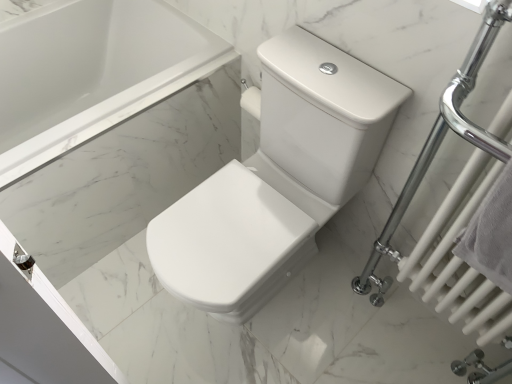
What do you see at coordinates (277, 179) in the screenshot? The height and width of the screenshot is (384, 512). I see `white glossy toilet at center` at bounding box center [277, 179].

Locate an element on the screen. The height and width of the screenshot is (384, 512). white glossy towel rack at right is located at coordinates (440, 143).

Locate an element on the screen. The width and height of the screenshot is (512, 384). white cotton towel at right is located at coordinates (490, 234).

In the scene shown: Is white marble bathtub at upper left to the right of white cotton towel at right from the viewer's perspective?

In fact, white marble bathtub at upper left is to the left of white cotton towel at right.

Could you tell me if white marble bathtub at upper left is turned towards white cotton towel at right?

Yes, white marble bathtub at upper left faces towards white cotton towel at right.

From the image's perspective, which is above, white marble bathtub at upper left or white cotton towel at right?

white marble bathtub at upper left.

Considering the sizes of white marble bathtub at upper left and white cotton towel at right in the image, is white marble bathtub at upper left wider or thinner than white cotton towel at right?

In the image, white marble bathtub at upper left appears to be wider than white cotton towel at right.

Considering the relative sizes of white cotton towel at right and white glossy toilet at center in the image provided, is white cotton towel at right bigger than white glossy toilet at center?

No, white cotton towel at right is not bigger than white glossy toilet at center.

From a real-world perspective, between white cotton towel at right and white glossy toilet at center, who is vertically lower?

white glossy toilet at center.

Is point (495, 240) less distant than point (277, 111)?

Yes, point (495, 240) is closer to viewer.

Locate an element on the screen. bath towel above the white glossy toilet at center (from a real-world perspective) is located at coordinates (490, 234).

Is white glossy toilet at center far away from white marble bathtub at upper left?

They are positioned close to each other.

Where is `bathtub below the white glossy toilet at center (from a real-world perspective)`? The width and height of the screenshot is (512, 384). bathtub below the white glossy toilet at center (from a real-world perspective) is located at coordinates (91, 73).

Considering the positions of objects white glossy toilet at center and white marble bathtub at upper left in the image provided, who is behind, white glossy toilet at center or white marble bathtub at upper left?

white marble bathtub at upper left is behind.

Does point (353, 172) appear closer or farther from the camera than point (26, 80)?

Point (353, 172) is closer to the camera than point (26, 80).

In the image, is white cotton towel at right positioned in front of or behind white glossy towel rack at right?

white cotton towel at right is positioned farther from the viewer than white glossy towel rack at right.

Is there a large distance between white cotton towel at right and white glossy towel rack at right?

That's not correct — white cotton towel at right is a little close to white glossy towel rack at right.

Is point (474, 231) positioned before point (465, 77)?

That is True.

Is white cotton towel at right taller or shorter than white glossy towel rack at right?

white cotton towel at right is shorter than white glossy towel rack at right.

From the image's perspective, which is below, white cotton towel at right or white marble bathtub at upper left?

white cotton towel at right.

How many degrees apart are the facing directions of white cotton towel at right and white marble bathtub at upper left?

They differ by 90.1 degrees in their facing directions.

Based on the photo, does white cotton towel at right lie behind white marble bathtub at upper left?

No, it is not.

In the scene shown: Which of these two, white cotton towel at right or white marble bathtub at upper left, stands shorter?

Standing shorter between the two is white cotton towel at right.

Is white glossy towel rack at right positioned with its back to white glossy toilet at center?

No.

From the image's perspective, relative to white glossy toilet at center, is white glossy towel rack at right above or below?

white glossy towel rack at right is situated lower than white glossy toilet at center in the image.

Which is correct: white glossy towel rack at right is inside white glossy toilet at center, or outside of it?

white glossy towel rack at right is outside white glossy toilet at center.

In order to click on shower below the white marble bathtub at upper left (from the image's perspective) in this screenshot , I will do [x=440, y=143].

Is white glossy towel rack at right positioned with its back to white marble bathtub at upper left?

white glossy towel rack at right does not have its back to white marble bathtub at upper left.

Can you confirm if white glossy towel rack at right is bigger than white marble bathtub at upper left?

No, white glossy towel rack at right is not bigger than white marble bathtub at upper left.

Considering the positions of objects white glossy towel rack at right and white marble bathtub at upper left in the image provided, who is more to the left, white glossy towel rack at right or white marble bathtub at upper left?

white marble bathtub at upper left.

This screenshot has height=384, width=512. What are the coordinates of `bath towel below the white marble bathtub at upper left (from the image's perspective)` in the screenshot? It's located at 490,234.

Identify the location of toilet on the left of white cotton towel at right. Image resolution: width=512 pixels, height=384 pixels. tap(277, 179).

Based on their spatial positions, is white glossy towel rack at right or white cotton towel at right closer to white glossy toilet at center?

white glossy towel rack at right lies closer to white glossy toilet at center than the other object.

When comparing their distances from white glossy toilet at center, does white cotton towel at right or white marble bathtub at upper left seem further?

The object further to white glossy toilet at center is white marble bathtub at upper left.

Estimate the real-world distances between objects in this image. Which object is closer to white marble bathtub at upper left, white glossy towel rack at right or white glossy toilet at center?

white glossy toilet at center is positioned closer to the anchor white marble bathtub at upper left.

Estimate the real-world distances between objects in this image. Which object is further from white glossy towel rack at right, white glossy toilet at center or white cotton towel at right?

The object further to white glossy towel rack at right is white glossy toilet at center.

Estimate the real-world distances between objects in this image. Which object is closer to white glossy toilet at center, white marble bathtub at upper left or white glossy towel rack at right?

white glossy towel rack at right is closer to white glossy toilet at center.

When comparing their distances from white cotton towel at right, does white glossy toilet at center or white marble bathtub at upper left seem further?

white marble bathtub at upper left is further to white cotton towel at right.

When comparing their distances from white marble bathtub at upper left, does white glossy toilet at center or white glossy towel rack at right seem closer?

Among the two, white glossy toilet at center is located nearer to white marble bathtub at upper left.

Based on their spatial positions, is white cotton towel at right or white glossy towel rack at right closer to white glossy toilet at center?

The object closer to white glossy toilet at center is white glossy towel rack at right.

You are a GUI agent. You are given a task and a screenshot of the screen. Output one action in this format:
    pyautogui.click(x=<x>, y=<y>)
    Task: Click on the toilet between white marble bathtub at upper left and white glossy towel rack at right in the horizontal direction
    This screenshot has width=512, height=384.
    Given the screenshot: What is the action you would take?
    pyautogui.click(x=277, y=179)

At what (x,y) coordinates should I click in order to perform the action: click on bath towel between white glossy toilet at center and white glossy towel rack at right from left to right. Please return your answer as a coordinate pair (x, y). Looking at the image, I should click on (490, 234).

What are the coordinates of `toilet between white marble bathtub at upper left and white cotton towel at right from left to right` in the screenshot? It's located at (277, 179).

I want to click on bath towel between white marble bathtub at upper left and white glossy towel rack at right, so click(x=490, y=234).